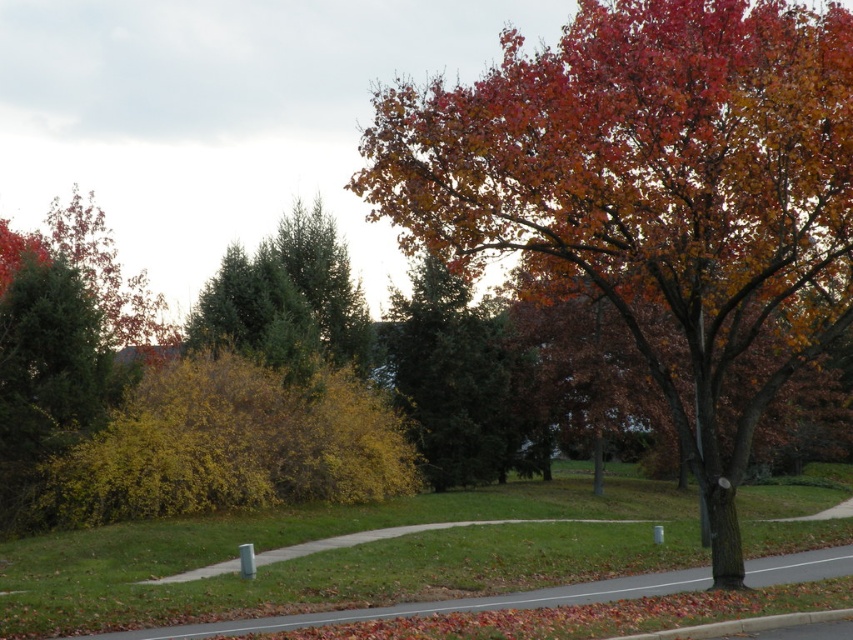
Question: Among these objects, which one is nearest to the camera?

Choices:
 (A) green evergreen tree at center
 (B) autumn leaves tree at center

Answer: (B)

Question: Among these points, which one is farthest from the camera?

Choices:
 (A) (238, 324)
 (B) (718, 72)

Answer: (A)

Question: Does autumn leaves tree at center appear over green evergreen tree at center?

Choices:
 (A) yes
 (B) no

Answer: (A)

Question: Observing the image, what is the correct spatial positioning of autumn leaves tree at center in reference to green evergreen tree at center?

Choices:
 (A) right
 (B) left

Answer: (A)

Question: Which object appears closest to the camera in this image?

Choices:
 (A) autumn leaves tree at center
 (B) green evergreen tree at center

Answer: (A)

Question: Considering the relative positions of autumn leaves tree at center and green evergreen tree at center in the image provided, where is autumn leaves tree at center located with respect to green evergreen tree at center?

Choices:
 (A) below
 (B) above

Answer: (B)